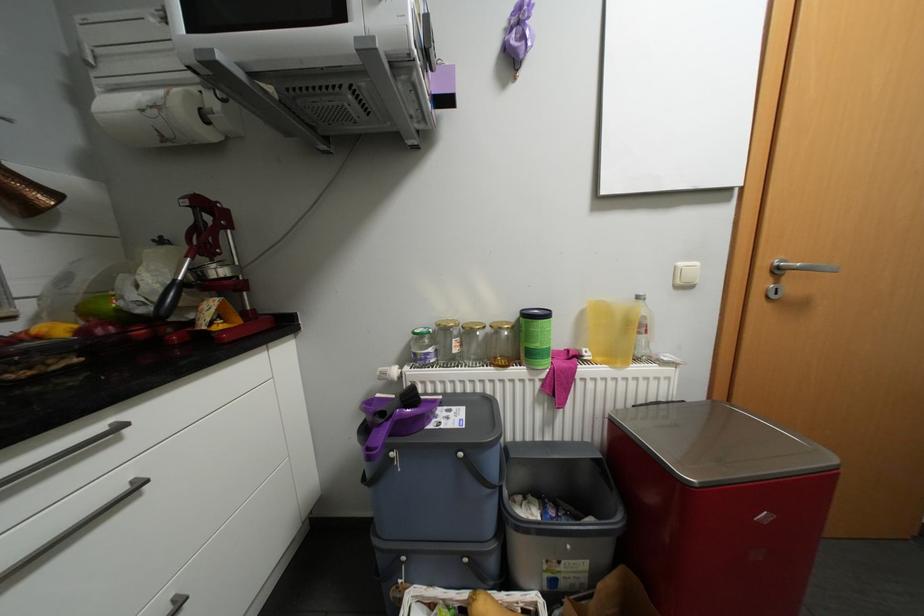
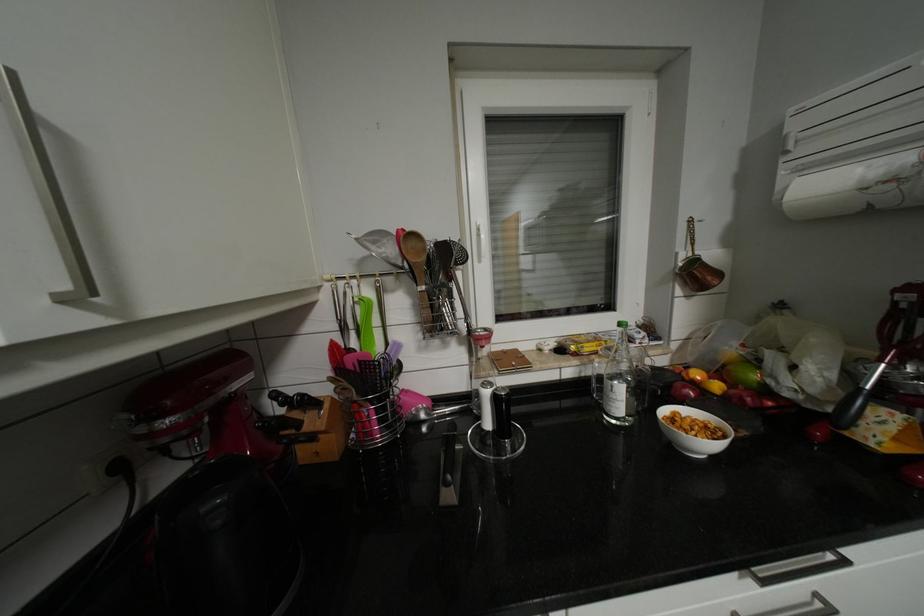
Locate, in the second image, the point that corresponds to [163,110] in the first image.

(898, 185)